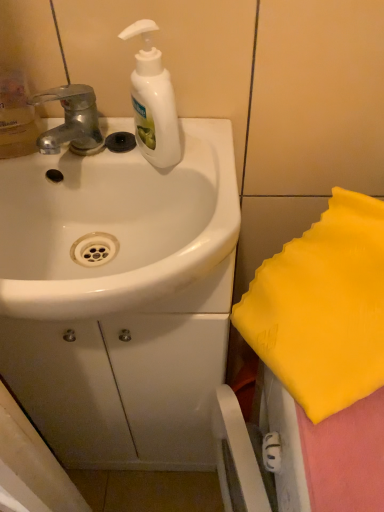
Question: Is white glossy soap dispenser at upper center taller or shorter than silver metallic faucet at upper left?

Choices:
 (A) short
 (B) tall

Answer: (B)

Question: In terms of size, does white glossy soap dispenser at upper center appear bigger or smaller than silver metallic faucet at upper left?

Choices:
 (A) big
 (B) small

Answer: (A)

Question: Which of these objects is positioned closest to the silver metallic faucet at upper left?

Choices:
 (A) white glossy soap dispenser at upper center
 (B) white glossy sink at center

Answer: (A)

Question: Considering the real-world distances, which object is closest to the white glossy soap dispenser at upper center?

Choices:
 (A) silver metallic faucet at upper left
 (B) white glossy sink at center

Answer: (A)